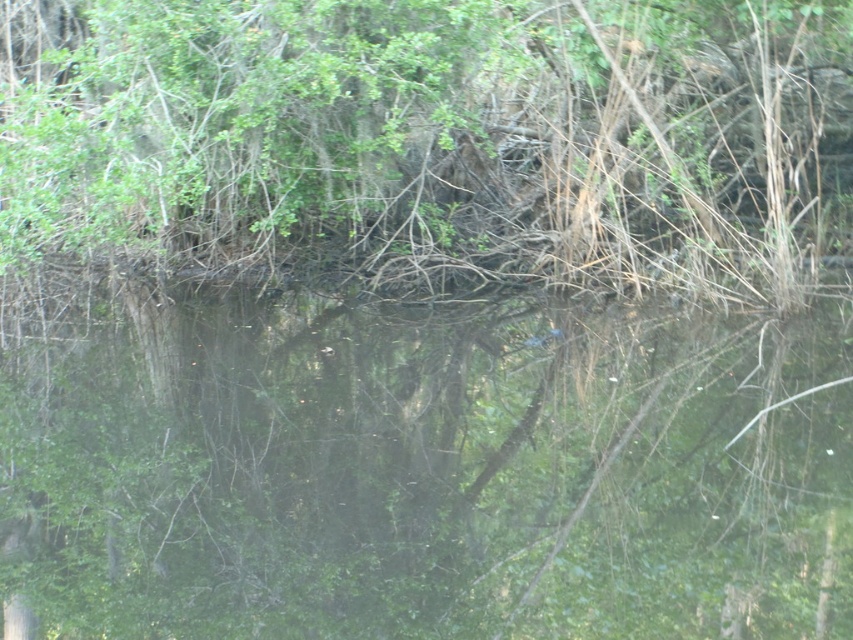
Which is above, green reflective water at center or green leafy tree at upper center?

Positioned higher is green leafy tree at upper center.

Which is in front, point (357, 497) or point (94, 246)?

Point (357, 497)

At what (x,y) coordinates should I click in order to perform the action: click on green reflective water at center. Please return your answer as a coordinate pair (x, y). This screenshot has height=640, width=853. Looking at the image, I should click on (416, 467).